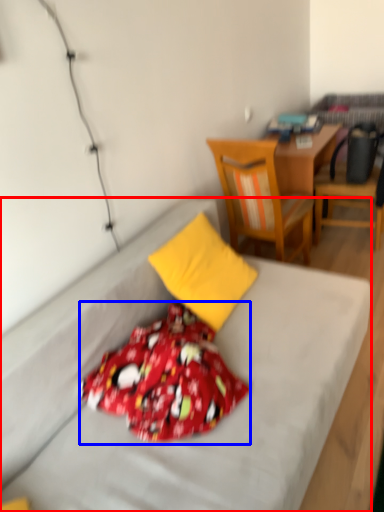
Question: Which of the following is the closest to the observer, bed (highlighted by a red box) or blanket (highlighted by a blue box)?

Choices:
 (A) bed
 (B) blanket

Answer: (A)